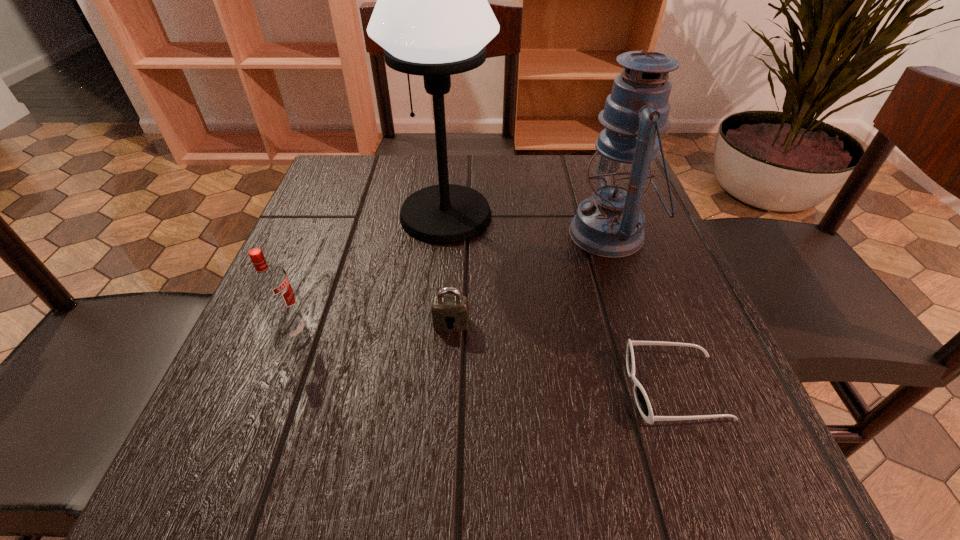
The image size is (960, 540). What are the coordinates of `blank space located 0.270m on the front-facing side of the lantern` in the screenshot? It's located at (438, 234).

You are a GUI agent. You are given a task and a screenshot of the screen. Output one action in this format:
    pyautogui.click(x=<x>, y=<y>)
    Task: Click on the free space located 0.110m on the front label of the leftmost object
    
    Given the screenshot: What is the action you would take?
    pyautogui.click(x=374, y=332)

Identify the location of vacant area located 0.150m at the front of the fourth tallest object near the keyhole. (445, 416).

The image size is (960, 540). I want to click on vacant space located 0.240m with the lenses of the shortest object facing outward, so click(x=464, y=388).

Find the location of a particular element. The width and height of the screenshot is (960, 540). blank space located 0.310m with the lenses of the shortest object facing outward is located at coordinates (417, 388).

Where is `blank area located 0.210m with the lenses of the shortest object facing outward`? Image resolution: width=960 pixels, height=540 pixels. blank area located 0.210m with the lenses of the shortest object facing outward is located at coordinates point(485,388).

This screenshot has height=540, width=960. I want to click on table lamp located in the far edge section of the desktop, so click(432, 17).

Identify the location of lantern located at the far edge. (609, 224).

What are the coordinates of `object that is at the left edge` in the screenshot? It's located at (269, 284).

You are a GUI agent. You are given a task and a screenshot of the screen. Output one action in this format:
    pyautogui.click(x=<x>, y=<y>)
    Task: Click on the lantern at the right edge
    The image size is (960, 540).
    Given the screenshot: What is the action you would take?
    pyautogui.click(x=609, y=224)